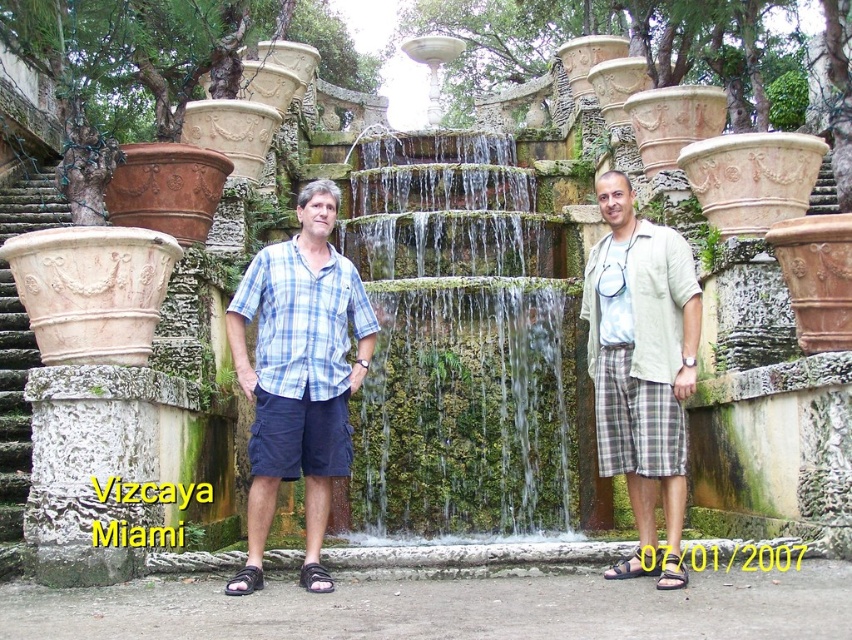
Is point (289, 442) positioned before point (628, 182)?

Yes.

Which is behind, point (353, 324) or point (620, 568)?

Positioned behind is point (353, 324).

You are a GUI agent. You are given a task and a screenshot of the screen. Output one action in this format:
    pyautogui.click(x=<x>, y=<y>)
    Task: Click on the blue plaid shirt at center
    
    Given the screenshot: What is the action you would take?
    pyautogui.click(x=298, y=376)

Between green mossy stone waterfall at center and light beige cotton shirt at center, which one is positioned higher?

green mossy stone waterfall at center is higher up.

Where is `green mossy stone waterfall at center`? The image size is (852, 640). green mossy stone waterfall at center is located at coordinates pyautogui.click(x=458, y=339).

Identify the location of green mossy stone waterfall at center. Image resolution: width=852 pixels, height=640 pixels. (458, 339).

What do you see at coordinates (458, 339) in the screenshot?
I see `green mossy stone waterfall at center` at bounding box center [458, 339].

Is point (493, 404) in front of point (263, 268)?

No, it is not.

What do you see at coordinates (458, 339) in the screenshot? I see `green mossy stone waterfall at center` at bounding box center [458, 339].

In order to click on green mossy stone waterfall at center in this screenshot , I will do `click(458, 339)`.